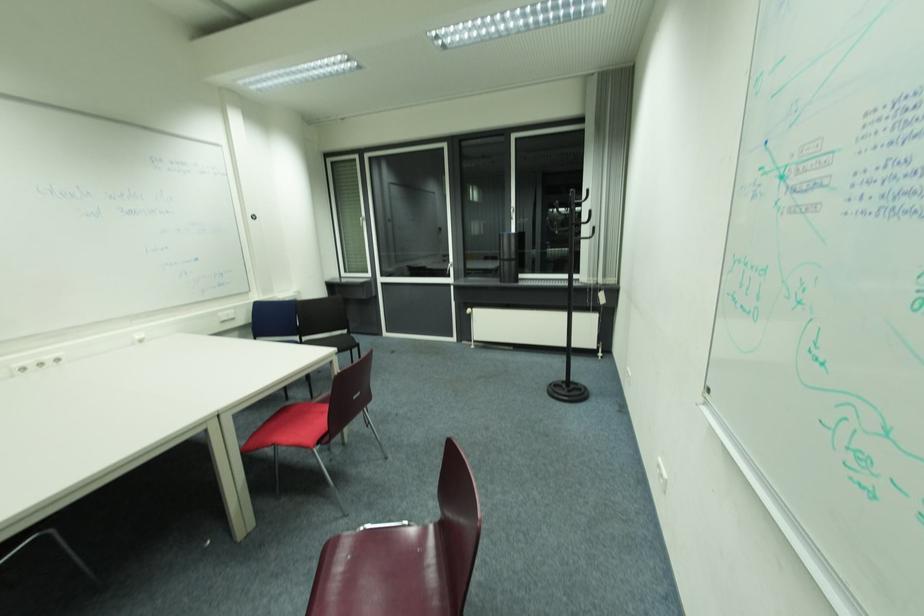
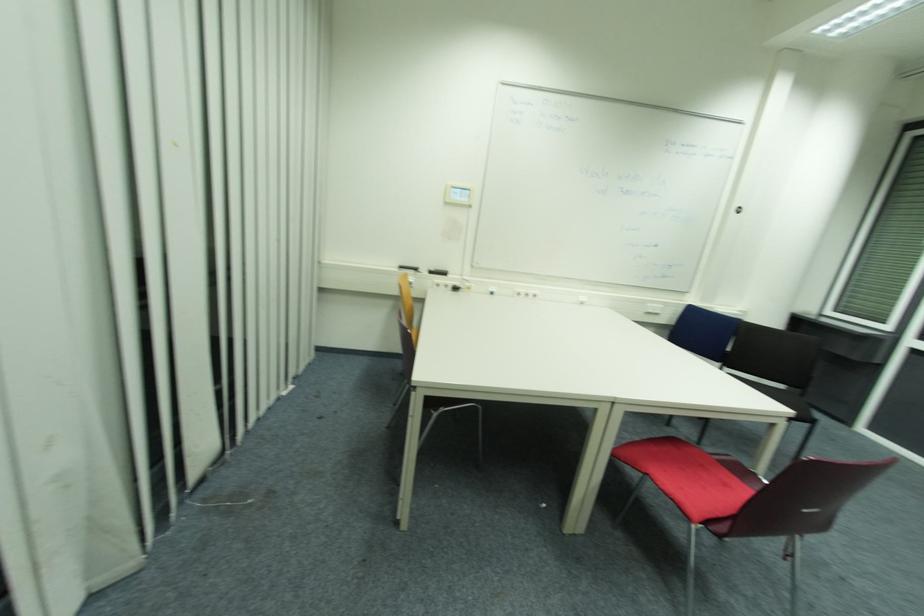
Where in the second image is the point corresponding to [46,365] from the first image?

(529, 294)